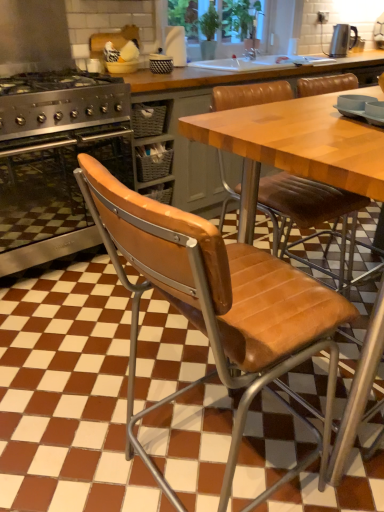
Question: Is brown leather chair at center further to camera compared to stainless steel oven at left?

Choices:
 (A) no
 (B) yes

Answer: (A)

Question: Is brown leather chair at center closer to the viewer compared to stainless steel oven at left?

Choices:
 (A) no
 (B) yes

Answer: (B)

Question: Is brown leather chair at center to the left of stainless steel oven at left from the viewer's perspective?

Choices:
 (A) yes
 (B) no

Answer: (B)

Question: Is brown leather chair at center outside stainless steel oven at left?

Choices:
 (A) yes
 (B) no

Answer: (A)

Question: Is brown leather chair at center smaller than stainless steel oven at left?

Choices:
 (A) yes
 (B) no

Answer: (A)

Question: Is stainless steel oven at left a part of brown leather chair at center?

Choices:
 (A) yes
 (B) no

Answer: (B)

Question: Is brown leather chair at center turned away from wooden table at center?

Choices:
 (A) no
 (B) yes

Answer: (A)

Question: From the image's perspective, does brown leather chair at center appear lower than wooden table at center?

Choices:
 (A) no
 (B) yes

Answer: (B)

Question: Is brown leather chair at center closer to the viewer compared to wooden table at center?

Choices:
 (A) no
 (B) yes

Answer: (B)

Question: Is brown leather chair at center far from wooden table at center?

Choices:
 (A) no
 (B) yes

Answer: (A)

Question: Considering the relative sizes of brown leather chair at center and wooden table at center in the image provided, is brown leather chair at center shorter than wooden table at center?

Choices:
 (A) yes
 (B) no

Answer: (B)

Question: Would you say brown leather chair at center is outside wooden table at center?

Choices:
 (A) no
 (B) yes

Answer: (B)

Question: From the image's perspective, does metallic silver kettle at upper right appear lower than brown leather chair at center?

Choices:
 (A) yes
 (B) no

Answer: (B)